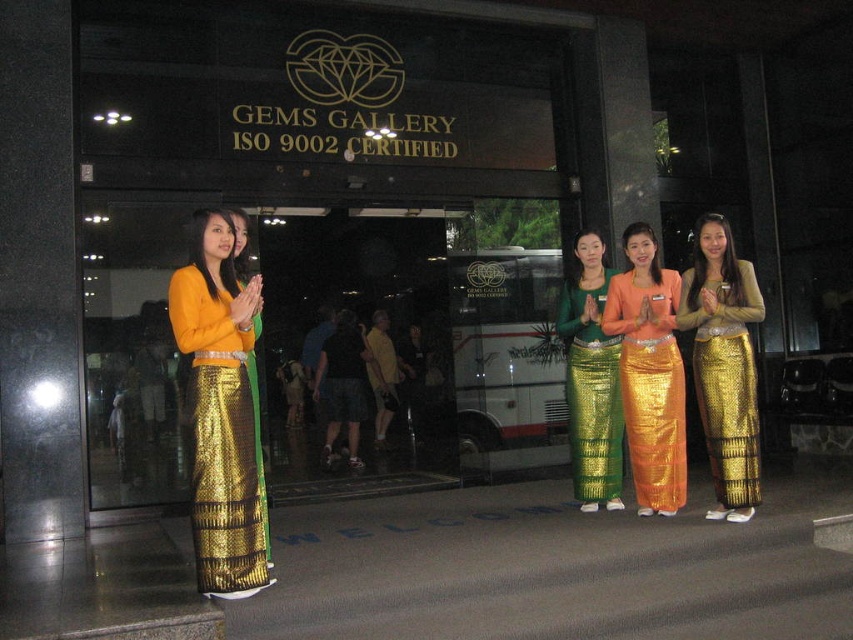
Question: Which object is positioned closest to the orange sequined skirt at center?

Choices:
 (A) gold sequined skirt at center
 (B) green sequined skirt at center
 (C) matte gold skirt at left

Answer: (A)

Question: Which object is farther from the camera taking this photo?

Choices:
 (A) gold sequined skirt at center
 (B) green sequined skirt at center
 (C) orange sequined skirt at center

Answer: (B)

Question: Is gold sequined skirt at center further to the viewer compared to orange sequined skirt at center?

Choices:
 (A) yes
 (B) no

Answer: (B)

Question: Can you confirm if orange sequined skirt at center is positioned to the right of green sequined skirt at center?

Choices:
 (A) no
 (B) yes

Answer: (B)

Question: Can you confirm if gold sequined skirt at center is positioned to the right of green sequined skirt at center?

Choices:
 (A) no
 (B) yes

Answer: (B)

Question: Among these points, which one is farthest from the camera?

Choices:
 (A) (695, 355)
 (B) (648, 292)

Answer: (B)